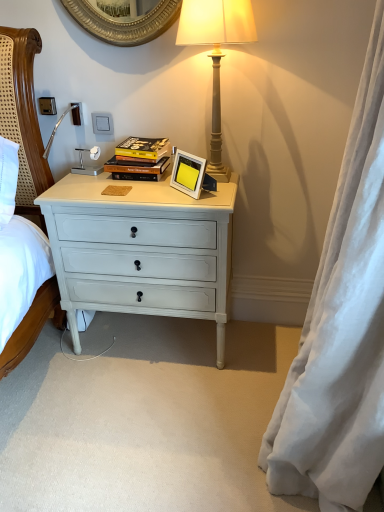
Find the location of a particular element. white plastic power outlet at upper left, arranged as the second power outlet when viewed from the right is located at coordinates (77, 113).

What is the approximate width of white plastic power outlet at upper left, which is the third power outlet in left-to-right order?

0.68 inches.

At what (x,y) coordinates should I click in order to perform the action: click on hardcover book at center. Please return your answer as a coordinate pair (x, y). Image resolution: width=384 pixels, height=512 pixels. Looking at the image, I should click on (140, 159).

The width and height of the screenshot is (384, 512). In order to click on wooden picture frame at center in this screenshot , I will do `click(188, 173)`.

This screenshot has height=512, width=384. What do you see at coordinates (47, 106) in the screenshot?
I see `satin silver power outlet at upper left, arranged as the 3th power outlet when viewed from the right` at bounding box center [47, 106].

This screenshot has width=384, height=512. What do you see at coordinates (141, 250) in the screenshot?
I see `white painted wood drawer at center` at bounding box center [141, 250].

You are a GUI agent. You are given a task and a screenshot of the screen. Output one action in this format:
    pyautogui.click(x=<x>, y=<y>)
    Task: Click on the white plastic power outlet at upper left, arranged as the 2th power outlet when viewed from the left
    The image size is (384, 512).
    Given the screenshot: What is the action you would take?
    pyautogui.click(x=77, y=113)

From the image's perspective, is wooden picture frame at center positioned above or below white plastic power outlet at upper left, arranged as the 2th power outlet when viewed from the left?

Based on their image positions, wooden picture frame at center is located beneath white plastic power outlet at upper left, arranged as the 2th power outlet when viewed from the left.

Does wooden picture frame at center turn towards white plastic power outlet at upper left, arranged as the second power outlet when viewed from the right?

No, wooden picture frame at center is not aimed at white plastic power outlet at upper left, arranged as the second power outlet when viewed from the right.

From a real-world perspective, which is physically below, wooden picture frame at center or white plastic power outlet at upper left, arranged as the 2th power outlet when viewed from the left?

From a 3D spatial view, wooden picture frame at center is below.

Who is taller, satin silver power outlet at upper left, arranged as the 3th power outlet when viewed from the right, or white plastic power outlet at upper left, which is the third power outlet in left-to-right order?

white plastic power outlet at upper left, which is the third power outlet in left-to-right order.

Is white plastic power outlet at upper left, acting as the 1th power outlet starting from the right, at the back of satin silver power outlet at upper left, arranged as the 3th power outlet when viewed from the right?

satin silver power outlet at upper left, arranged as the 3th power outlet when viewed from the right, does not have its back to white plastic power outlet at upper left, acting as the 1th power outlet starting from the right.

Between satin silver power outlet at upper left, which is the 1th power outlet from left to right, and white plastic power outlet at upper left, which is the third power outlet in left-to-right order, which one has larger size?

With larger size is satin silver power outlet at upper left, which is the 1th power outlet from left to right.

Is matte beige lamp at upper right in contact with white plastic power outlet at upper left, which is the third power outlet in left-to-right order?

There is a gap between matte beige lamp at upper right and white plastic power outlet at upper left, which is the third power outlet in left-to-right order.

Is matte beige lamp at upper right turned away from white plastic power outlet at upper left, acting as the 1th power outlet starting from the right?

That's not correct — matte beige lamp at upper right is not looking away from white plastic power outlet at upper left, acting as the 1th power outlet starting from the right.

From the image's perspective, is matte beige lamp at upper right above white plastic power outlet at upper left, which is the third power outlet in left-to-right order?

Yes, from the image's perspective, matte beige lamp at upper right is on top of white plastic power outlet at upper left, which is the third power outlet in left-to-right order.

Considering the sizes of objects matte beige lamp at upper right and white plastic power outlet at upper left, acting as the 1th power outlet starting from the right, in the image provided, who is wider, matte beige lamp at upper right or white plastic power outlet at upper left, acting as the 1th power outlet starting from the right,?

With larger width is matte beige lamp at upper right.

What's the angular difference between white plastic power outlet at upper left, arranged as the second power outlet when viewed from the right, and white silky curtain at right's facing directions?

They differ by 90.3 degrees in their facing directions.

From the image's perspective, which is above, white plastic power outlet at upper left, arranged as the second power outlet when viewed from the right, or white silky curtain at right?

white plastic power outlet at upper left, arranged as the second power outlet when viewed from the right, from the image's perspective.

Can white silky curtain at right be found inside white plastic power outlet at upper left, arranged as the second power outlet when viewed from the right?

Actually, white silky curtain at right is outside white plastic power outlet at upper left, arranged as the second power outlet when viewed from the right.

Is white plastic power outlet at upper left, arranged as the 2th power outlet when viewed from the left, directly adjacent to white silky curtain at right?

white plastic power outlet at upper left, arranged as the 2th power outlet when viewed from the left, and white silky curtain at right are not in contact.

Is white silky curtain at right bigger or smaller than matte beige lamp at upper right?

white silky curtain at right is bigger than matte beige lamp at upper right.

Considering the relative positions of white silky curtain at right and matte beige lamp at upper right in the image provided, is white silky curtain at right in front of matte beige lamp at upper right?

Yes, it is.

Consider the image. Is matte beige lamp at upper right located within white silky curtain at right?

No, matte beige lamp at upper right is not a part of white silky curtain at right.

How different are the orientations of white plastic power outlet at upper left, acting as the 1th power outlet starting from the right, and satin silver power outlet at upper left, arranged as the 3th power outlet when viewed from the right, in degrees?

The angle between the facing direction of white plastic power outlet at upper left, acting as the 1th power outlet starting from the right, and the facing direction of satin silver power outlet at upper left, arranged as the 3th power outlet when viewed from the right, is 1.25 degrees.

Is white plastic power outlet at upper left, which is the third power outlet in left-to-right order, positioned behind satin silver power outlet at upper left, arranged as the 3th power outlet when viewed from the right?

Yes, white plastic power outlet at upper left, which is the third power outlet in left-to-right order, is further from the camera.

Are white plastic power outlet at upper left, which is the third power outlet in left-to-right order, and satin silver power outlet at upper left, arranged as the 3th power outlet when viewed from the right, making contact?

white plastic power outlet at upper left, which is the third power outlet in left-to-right order, and satin silver power outlet at upper left, arranged as the 3th power outlet when viewed from the right, are clearly separated.

Is white plastic power outlet at upper left, acting as the 1th power outlet starting from the right, spatially inside satin silver power outlet at upper left, which is the 1th power outlet from left to right, or outside of it?

white plastic power outlet at upper left, acting as the 1th power outlet starting from the right, lies outside satin silver power outlet at upper left, which is the 1th power outlet from left to right.

From a real-world perspective, is white plastic power outlet at upper left, acting as the 1th power outlet starting from the right, located higher than hardcover book at center?

Yes.

From the picture: Is white plastic power outlet at upper left, acting as the 1th power outlet starting from the right, shorter than hardcover book at center?

Correct, white plastic power outlet at upper left, acting as the 1th power outlet starting from the right, is not as tall as hardcover book at center.

Are white plastic power outlet at upper left, which is the third power outlet in left-to-right order, and hardcover book at center beside each other?

No, white plastic power outlet at upper left, which is the third power outlet in left-to-right order, is not next to hardcover book at center.

From the image's perspective, which power outlet is the 1st one above the hardcover book at center? Please provide its 2D coordinates.

[(102, 123)]

Locate an element on the screen. This screenshot has height=512, width=384. power outlet that is the 2nd one when counting upward from the wooden picture frame at center (from the image's perspective) is located at coordinates (77, 113).

From the image's perspective, which power outlet is the 2nd one below the satin silver power outlet at upper left, arranged as the 3th power outlet when viewed from the right? Please provide its 2D coordinates.

[(102, 123)]

Considering their positions, is white silky curtain at right positioned further to white painted wood drawer at center than white plastic power outlet at upper left, which is the third power outlet in left-to-right order?

white silky curtain at right is positioned further to the anchor white painted wood drawer at center.

Estimate the real-world distances between objects in this image. Which object is closer to satin silver power outlet at upper left, which is the 1th power outlet from left to right, white painted wood drawer at center or white plastic power outlet at upper left, arranged as the 2th power outlet when viewed from the left?

The object closer to satin silver power outlet at upper left, which is the 1th power outlet from left to right, is white plastic power outlet at upper left, arranged as the 2th power outlet when viewed from the left.

Based on their spatial positions, is white silky curtain at right or white plastic power outlet at upper left, acting as the 1th power outlet starting from the right, closer to white plastic power outlet at upper left, arranged as the second power outlet when viewed from the right?

white plastic power outlet at upper left, acting as the 1th power outlet starting from the right, lies closer to white plastic power outlet at upper left, arranged as the second power outlet when viewed from the right, than the other object.

Looking at this image, considering their positions, is satin silver power outlet at upper left, which is the 1th power outlet from left to right, positioned closer to white painted wood drawer at center than white plastic power outlet at upper left, arranged as the second power outlet when viewed from the right?

white plastic power outlet at upper left, arranged as the second power outlet when viewed from the right.

Looking at the image, which one is located further to white plastic power outlet at upper left, acting as the 1th power outlet starting from the right, matte beige lamp at upper right or white painted wood drawer at center?

white painted wood drawer at center is positioned further to the anchor white plastic power outlet at upper left, acting as the 1th power outlet starting from the right.

When comparing their distances from white painted wood drawer at center, does white plastic power outlet at upper left, acting as the 1th power outlet starting from the right, or white silky curtain at right seem further?

white silky curtain at right is positioned further to the anchor white painted wood drawer at center.

From the image, which object appears to be farther from white painted wood drawer at center, wooden picture frame at center or hardcover book at center?

wooden picture frame at center is positioned further to the anchor white painted wood drawer at center.

From the image, which object appears to be nearer to white plastic power outlet at upper left, arranged as the 2th power outlet when viewed from the left, white painted wood drawer at center or wooden picture frame at center?

wooden picture frame at center lies closer to white plastic power outlet at upper left, arranged as the 2th power outlet when viewed from the left, than the other object.

Find the location of `book that lies between matte beige lamp at upper right and white painted wood drawer at center from top to bottom`. book that lies between matte beige lamp at upper right and white painted wood drawer at center from top to bottom is located at coordinates (140, 159).

In order to click on book located between white silky curtain at right and white plastic power outlet at upper left, arranged as the 2th power outlet when viewed from the left, in the depth direction in this screenshot , I will do `click(140, 159)`.

I want to click on picture frame between white silky curtain at right and white plastic power outlet at upper left, acting as the 1th power outlet starting from the right, from front to back, so click(x=188, y=173).

Where is `desk located between white silky curtain at right and satin silver power outlet at upper left, arranged as the 3th power outlet when viewed from the right, in the depth direction`? The height and width of the screenshot is (512, 384). desk located between white silky curtain at right and satin silver power outlet at upper left, arranged as the 3th power outlet when viewed from the right, in the depth direction is located at coordinates (141, 250).